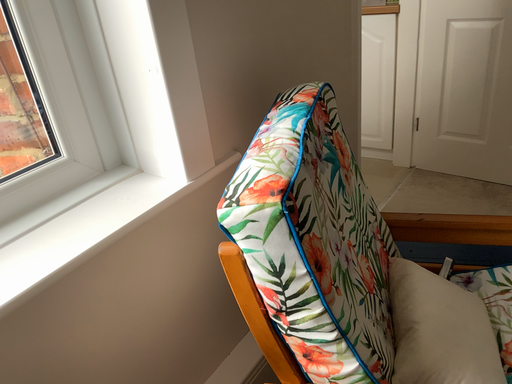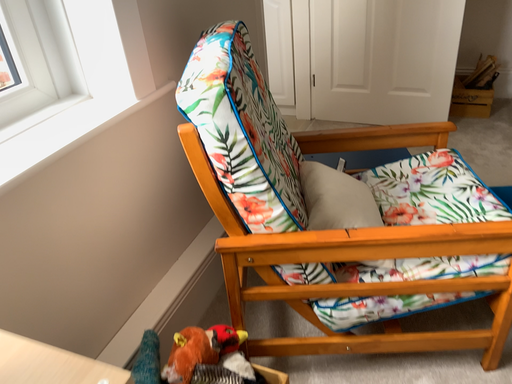
Question: Which way did the camera rotate in the video?

Choices:
 (A) rotated right
 (B) rotated left

Answer: (A)